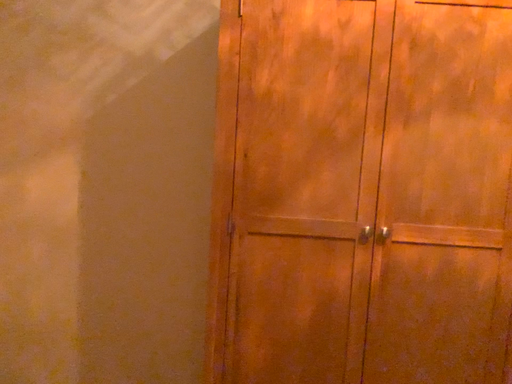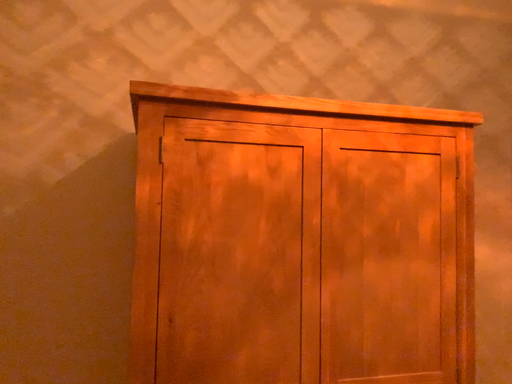
Question: Which way did the camera rotate in the video?

Choices:
 (A) rotated right
 (B) rotated left

Answer: (A)